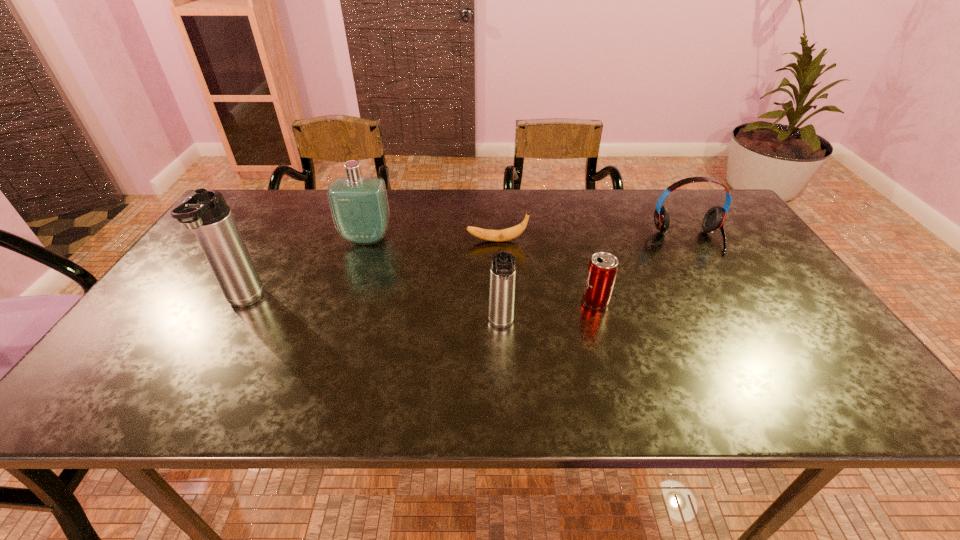
The width and height of the screenshot is (960, 540). I want to click on free space that is in between the perfume and the tallest object, so click(305, 271).

Identify the location of free space between the right thermos bottle and the leftmost object. (372, 314).

The image size is (960, 540). Find the location of `empty space that is in between the headset and the banana`. empty space that is in between the headset and the banana is located at coordinates (592, 240).

This screenshot has height=540, width=960. I want to click on vacant point located between the perfume and the shorter thermos bottle, so click(434, 282).

This screenshot has width=960, height=540. Identify the location of unoccupied position between the second object from left to right and the rightmost object. (527, 239).

Identify the location of the fourth closest object to the rightmost object. (359, 206).

Choose which object is the second nearest neighbor to the fifth object from right to left. Please provide its 2D coordinates. Your answer should be formatted as a tuple, i.e. [(x, y)], where the tuple contains the x and y coordinates of a point satisfying the conditions above.

[(507, 234)]

You are a GUI agent. You are given a task and a screenshot of the screen. Output one action in this format:
    pyautogui.click(x=<x>, y=<y>)
    Task: Click on the free region that satisfies the following two spatial constraints: 1. on the peel of the shortest object from the top; 2. on the handle side of the tallest object
    The width and height of the screenshot is (960, 540).
    Given the screenshot: What is the action you would take?
    pyautogui.click(x=499, y=302)

This screenshot has width=960, height=540. Find the location of `vacant space that satisfies the following two spatial constraints: 1. on the peel of the shortest object from the top; 2. on the handle side of the left thermos bottle`. vacant space that satisfies the following two spatial constraints: 1. on the peel of the shortest object from the top; 2. on the handle side of the left thermos bottle is located at coordinates (499, 302).

At what (x,y) coordinates should I click in order to perform the action: click on vacant space that satisfies the following two spatial constraints: 1. on the peel of the beer can from the top; 2. on the right side of the shortest object. Please return your answer as a coordinate pair (x, y). This screenshot has height=540, width=960. Looking at the image, I should click on (499, 301).